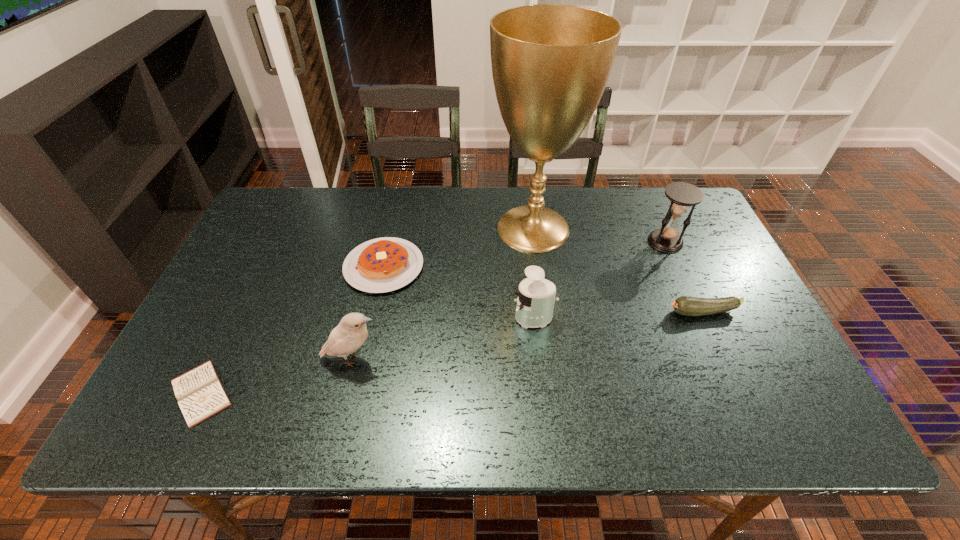
Locate an element on the screen. free space at the far right corner of the desktop is located at coordinates (661, 201).

This screenshot has width=960, height=540. Identify the location of free spot between the hourglass and the juicer. (600, 280).

At what (x,y) coordinates should I click in order to perform the action: click on empty location between the diary and the hourglass. Please return your answer as a coordinate pair (x, y). Image resolution: width=960 pixels, height=540 pixels. Looking at the image, I should click on (433, 317).

Where is `free point between the shortest object and the pancake`? This screenshot has width=960, height=540. free point between the shortest object and the pancake is located at coordinates coord(292,329).

Locate an element on the screen. This screenshot has height=540, width=960. free space between the hourglass and the tallest object is located at coordinates (599, 235).

Locate an element on the screen. free area in between the hourglass and the leftmost object is located at coordinates (433, 317).

Where is `vacant space in between the hourglass and the tallest object`? The image size is (960, 540). vacant space in between the hourglass and the tallest object is located at coordinates (599, 235).

At what (x,y) coordinates should I click in order to perform the action: click on free space between the hourglass and the shortest object. Please return your answer as a coordinate pair (x, y). Image resolution: width=960 pixels, height=540 pixels. Looking at the image, I should click on (433, 317).

I want to click on free space between the zucchini and the bird, so click(528, 336).

Identify the location of free space that is in between the leftmost object and the bird. coord(276,376).